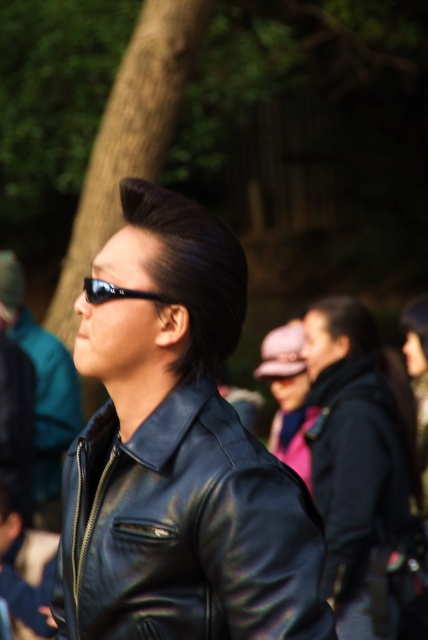
Does point (94, 573) lie behind point (2, 262)?

No, (94, 573) is closer to viewer.

Between shiny black leather jacket at center and shiny black jacket at center, which one appears on the left side from the viewer's perspective?

shiny black jacket at center

Who is more distant from viewer, (107, 547) or (56, 488)?

The point (56, 488) is more distant.

At what (x,y) coordinates should I click in order to perform the action: click on shiny black leather jacket at center. Please return your answer as a coordinate pair (x, y). The image size is (428, 640). Looking at the image, I should click on (186, 531).

Does shiny black jacket at center appear over sunglasses at center?

Actually, shiny black jacket at center is below sunglasses at center.

How much distance is there between shiny black jacket at center and sunglasses at center?

shiny black jacket at center is 4.20 meters from sunglasses at center.

Who is more distant from viewer, (62,442) or (154,298)?

The point (62,442) is more distant.

This screenshot has height=640, width=428. In order to click on shiny black jacket at center in this screenshot , I will do `click(42, 387)`.

Between shiny black leather jacket at center and matte black jacket at center, which one is positioned higher?

Positioned higher is shiny black leather jacket at center.

What do you see at coordinates (186, 531) in the screenshot? Image resolution: width=428 pixels, height=640 pixels. I see `shiny black leather jacket at center` at bounding box center [186, 531].

Identify the location of shiny black leather jacket at center. The image size is (428, 640). (186, 531).